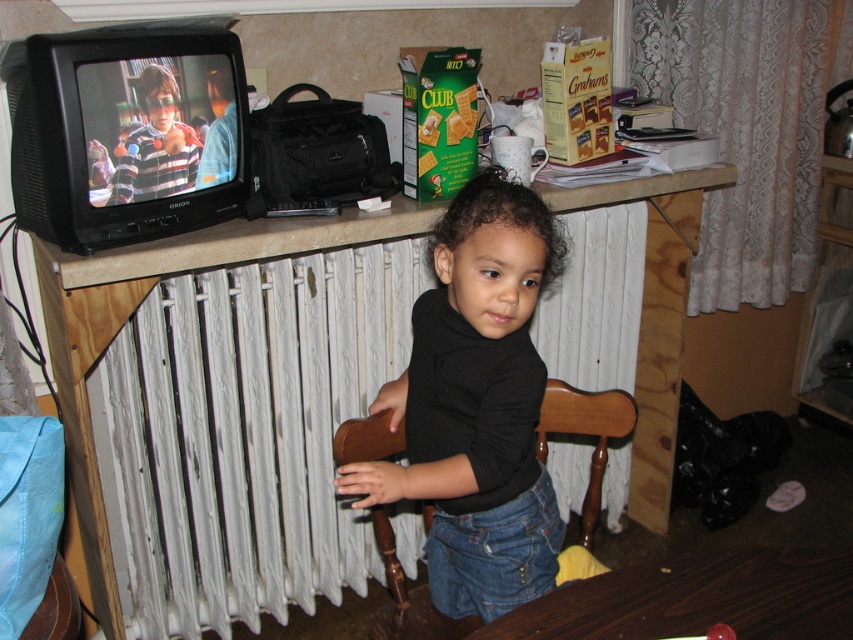
You are taking a photo of the scene and want to ensure both the point at coordinates point (x=824, y=592) and the point at coordinates point (x=563, y=390) are in focus. Which point should you focus on to ensure both are sharp?

You should focus on the point that is farther from the camera, which is point (x=563, y=390), because when focusing on the farther point, the closer point at (x=824, y=592) will also be within the depth of field.

From the picture: You are a delivery person entering the room and need to place a package on the dark wood table at lower center. However, you notice the white painted radiator at center is in the way. Can you move past the radiator to reach the table?

The white painted radiator at center is further to the viewer than the dark wood table at lower center, meaning the radiator is closer to you. Since the radiator is closer, you would need to move around it to access the table behind it.

You are standing in the living room and want to place a small plant between the two points labeled as point (381, 502) and point (747, 554). Which point should the plant be closer to so it is positioned in front of the radiator?

The plant should be closer to point (747, 554) because point (381, 502) is behind point (747, 554), so placing it near the front point would ensure it is in front of the radiator.